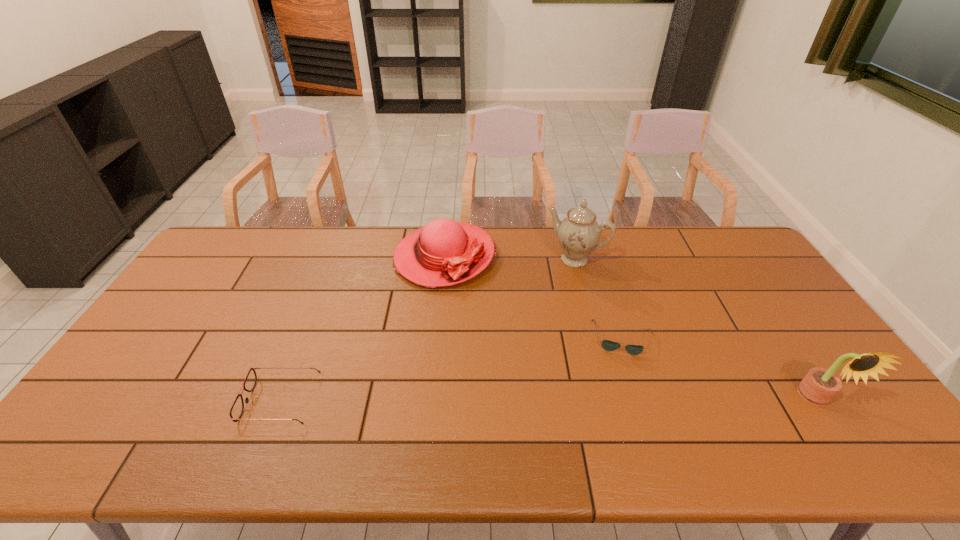
This screenshot has width=960, height=540. I want to click on vacant space on the desktop that is between the second shortest object and the rightmost object and is positioned on the spout of the chinaware, so click(485, 400).

Find the location of a particular element. The width and height of the screenshot is (960, 540). vacant space on the desktop that is between the second shortest object and the rightmost object and is positioned at the front of the second object from left to right with a bow is located at coordinates (472, 401).

Identify the location of vacant space on the desktop that is between the taller sunglasses and the sunflower and is positioned on the lenses of the farther sunglasses. The width and height of the screenshot is (960, 540). (625, 400).